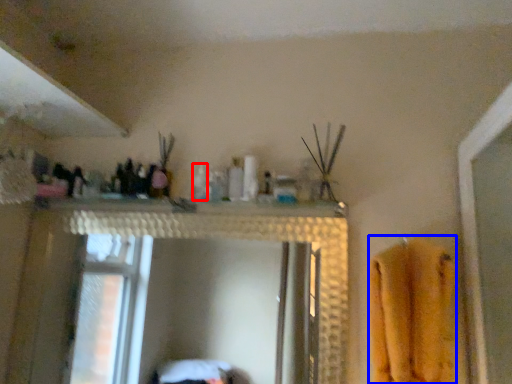
Question: Which object is closer to the camera taking this photo, toiletry (highlighted by a red box) or bath towel (highlighted by a blue box)?

Choices:
 (A) toiletry
 (B) bath towel

Answer: (B)